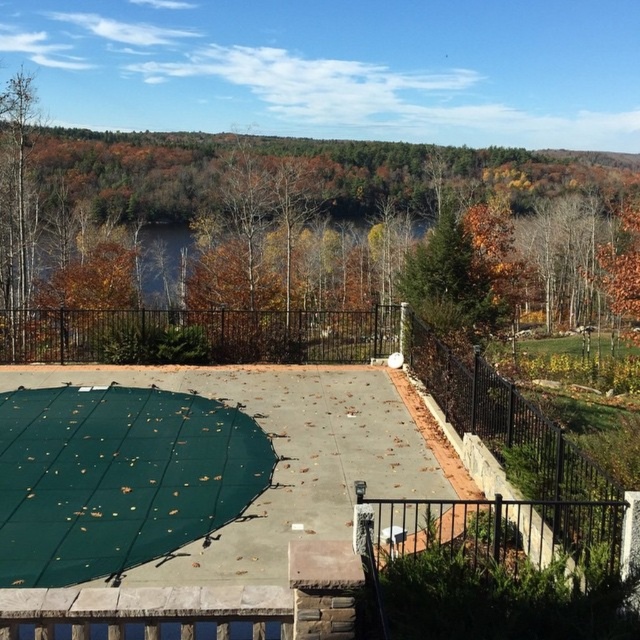
Question: Where is green matte fence at upper center located in relation to green mesh at center in the image?

Choices:
 (A) below
 (B) above

Answer: (B)

Question: Among these points, which one is farthest from the camera?

Choices:
 (A) (257, 563)
 (B) (292, 188)

Answer: (B)

Question: Which of the following is the farthest from the observer?

Choices:
 (A) (196, 520)
 (B) (513, 198)

Answer: (B)

Question: Can you confirm if green matte fence at upper center is wider than green mesh at center?

Choices:
 (A) yes
 (B) no

Answer: (A)

Question: Is green matte fence at upper center to the right of green mesh at center from the viewer's perspective?

Choices:
 (A) yes
 (B) no

Answer: (B)